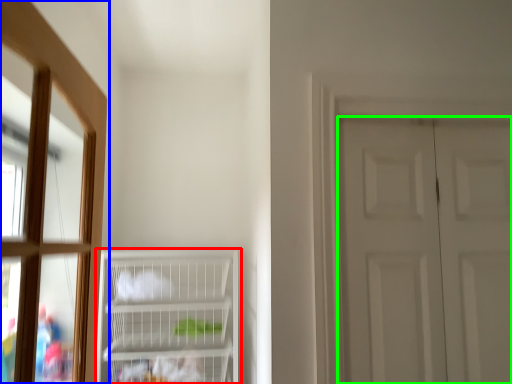
Question: Estimate the real-world distances between objects in this image. Which object is closer to cupboard (highlighted by a red box), window (highlighted by a blue box) or door (highlighted by a green box)?

Choices:
 (A) window
 (B) door

Answer: (A)